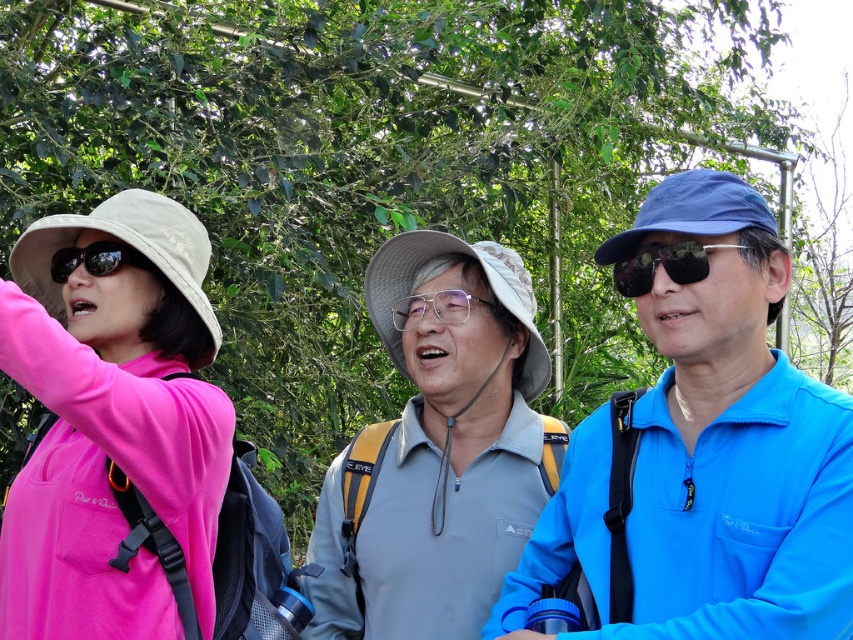
Between pink matte jacket at left and matte black sunglasses at left, which one is positioned higher?

Positioned higher is matte black sunglasses at left.

Who is positioned more to the left, pink matte jacket at left or matte black sunglasses at left?

matte black sunglasses at left

Is point (73, 582) behind point (55, 282)?

That is False.

The width and height of the screenshot is (853, 640). I want to click on pink matte jacket at left, so click(111, 422).

Between point (743, 234) and point (202, 538), which one is positioned behind?

The point (202, 538) is more distant.

Can you confirm if blue matte jacket at right is positioned above pink matte jacket at left?

Actually, blue matte jacket at right is below pink matte jacket at left.

Measure the distance between point (601,429) and camera.

Point (601,429) is 7.56 feet away from camera.

The image size is (853, 640). Find the location of `blue matte jacket at right`. blue matte jacket at right is located at coordinates (706, 445).

Who is lower down, sunglasses at center or matte black sunglasses at left?

sunglasses at center

Describe the element at coordinates (664, 264) in the screenshot. The height and width of the screenshot is (640, 853). I see `sunglasses at center` at that location.

Where is `sunglasses at center`? The image size is (853, 640). sunglasses at center is located at coordinates (664, 264).